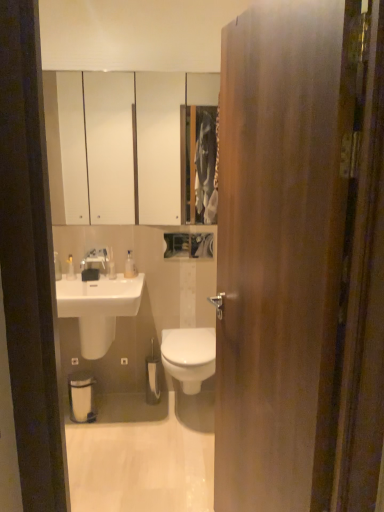
The width and height of the screenshot is (384, 512). I want to click on blank area beneath white glossy sink at lower left (from a real-world perspective), so click(x=109, y=416).